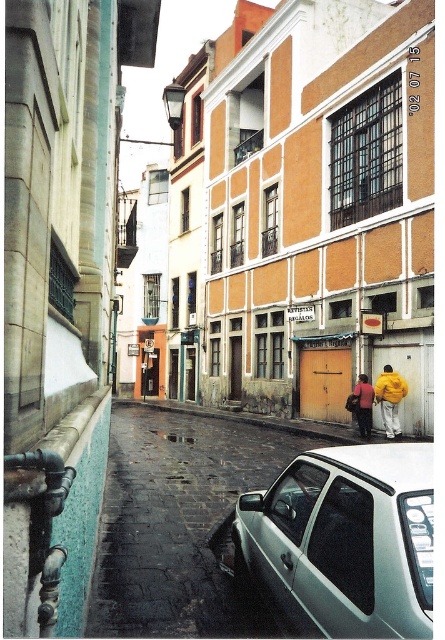
Who is positioned more to the right, white glossy car at lower right or yellow matte jacket at lower right?

From the viewer's perspective, yellow matte jacket at lower right appears more on the right side.

Is white glossy car at lower right closer to the viewer compared to yellow matte jacket at lower right?

That is True.

Is point (93, 604) farther from camera compared to point (381, 380)?

No, (93, 604) is closer to viewer.

This screenshot has width=445, height=640. I want to click on white glossy car at lower right, so click(178, 522).

What do you see at coordinates (178, 522) in the screenshot?
I see `white glossy car at lower right` at bounding box center [178, 522].

This screenshot has width=445, height=640. Describe the element at coordinates (178, 522) in the screenshot. I see `white glossy car at lower right` at that location.

Identify the location of white glossy car at lower right. (178, 522).

Does yellow matte jacket at lower right have a greater width compared to yellow fabric jacket at lower right?

Yes.

Which is above, yellow matte jacket at lower right or yellow fabric jacket at lower right?

yellow matte jacket at lower right is higher up.

This screenshot has height=640, width=445. I want to click on yellow matte jacket at lower right, so click(x=389, y=397).

Identify the location of yellow matte jacket at lower right. This screenshot has width=445, height=640. (389, 397).